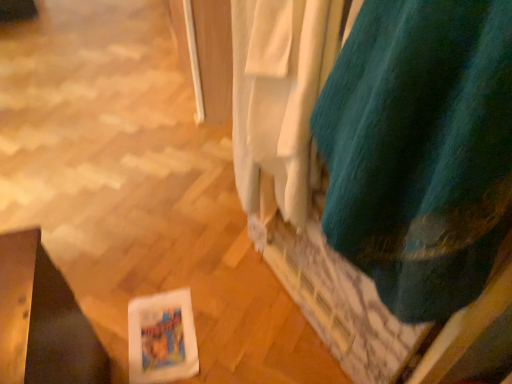
What do you see at coordinates (281, 94) in the screenshot?
I see `teal fabric curtain at upper right, which is the 2th curtain in right-to-left order` at bounding box center [281, 94].

This screenshot has height=384, width=512. In order to click on teal fabric curtain at upper right, which is the 2th curtain in right-to-left order in this screenshot , I will do click(x=281, y=94).

At what (x,y) coordinates should I click in order to perform the action: click on teal felt curtain at right, arranged as the first curtain when viewed from the right. Please return your answer as a coordinate pair (x, y). This screenshot has height=384, width=512. Looking at the image, I should click on (420, 149).

The height and width of the screenshot is (384, 512). What do you see at coordinates (420, 149) in the screenshot? I see `teal felt curtain at right, the second curtain positioned from the left` at bounding box center [420, 149].

Measure the distance between teal felt curtain at right, the second curtain positioned from the left, and camera.

teal felt curtain at right, the second curtain positioned from the left, and camera are 14.84 inches apart.

Where is `teal fabric curtain at upper right, which is the 2th curtain in right-to-left order`? Image resolution: width=512 pixels, height=384 pixels. teal fabric curtain at upper right, which is the 2th curtain in right-to-left order is located at coordinates (281, 94).

Between teal fabric curtain at upper right, which is the 1th curtain in left-to-right order, and teal felt curtain at right, arranged as the first curtain when viewed from the right, which one appears on the right side from the viewer's perspective?

Positioned to the right is teal felt curtain at right, arranged as the first curtain when viewed from the right.

Between teal fabric curtain at upper right, which is the 1th curtain in left-to-right order, and teal felt curtain at right, the second curtain positioned from the left, which one is positioned in front?

teal felt curtain at right, the second curtain positioned from the left, is in front.

Between point (284, 197) and point (390, 38), which one is positioned in front?

The point (390, 38) is closer to the camera.

From the image's perspective, which one is positioned higher, teal fabric curtain at upper right, which is the 2th curtain in right-to-left order, or teal felt curtain at right, the second curtain positioned from the left?

teal fabric curtain at upper right, which is the 2th curtain in right-to-left order, from the image's perspective.

From a real-world perspective, which object rests below the other?

From a 3D spatial view, teal fabric curtain at upper right, which is the 1th curtain in left-to-right order, is below.

Between teal fabric curtain at upper right, which is the 1th curtain in left-to-right order, and teal felt curtain at right, arranged as the first curtain when viewed from the right, which one has larger width?

Wider between the two is teal felt curtain at right, arranged as the first curtain when viewed from the right.

Does teal fabric curtain at upper right, which is the 2th curtain in right-to-left order, have a greater height compared to teal felt curtain at right, the second curtain positioned from the left?

Yes, teal fabric curtain at upper right, which is the 2th curtain in right-to-left order, is taller than teal felt curtain at right, the second curtain positioned from the left.

Who is bigger, teal fabric curtain at upper right, which is the 1th curtain in left-to-right order, or teal felt curtain at right, arranged as the first curtain when viewed from the right?

teal felt curtain at right, arranged as the first curtain when viewed from the right, is bigger.

Is teal fabric curtain at upper right, which is the 2th curtain in right-to-left order, outside of teal felt curtain at right, arranged as the first curtain when viewed from the right?

Yes, teal fabric curtain at upper right, which is the 2th curtain in right-to-left order, is outside of teal felt curtain at right, arranged as the first curtain when viewed from the right.

Is teal fabric curtain at upper right, which is the 1th curtain in left-to-right order, not close to teal felt curtain at right, the second curtain positioned from the left?

No, teal fabric curtain at upper right, which is the 1th curtain in left-to-right order, is not far from teal felt curtain at right, the second curtain positioned from the left.

Could you tell me if teal fabric curtain at upper right, which is the 2th curtain in right-to-left order, is facing teal felt curtain at right, arranged as the first curtain when viewed from the right?

No, teal fabric curtain at upper right, which is the 2th curtain in right-to-left order, is not facing towards teal felt curtain at right, arranged as the first curtain when viewed from the right.

The width and height of the screenshot is (512, 384). Identify the location of curtain below the teal fabric curtain at upper right, which is the 1th curtain in left-to-right order (from the image's perspective). (420, 149).

Is teal felt curtain at right, arranged as the first curtain when viewed from the right, to the left of teal fabric curtain at upper right, which is the 1th curtain in left-to-right order, from the viewer's perspective?

In fact, teal felt curtain at right, arranged as the first curtain when viewed from the right, is to the right of teal fabric curtain at upper right, which is the 1th curtain in left-to-right order.

Is teal felt curtain at right, the second curtain positioned from the left, closer to the viewer compared to teal fabric curtain at upper right, which is the 1th curtain in left-to-right order?

Yes, it is.

Is point (417, 110) behind point (294, 135)?

That is False.

From the image's perspective, which object appears higher, teal felt curtain at right, arranged as the first curtain when viewed from the right, or teal fabric curtain at upper right, which is the 1th curtain in left-to-right order?

teal fabric curtain at upper right, which is the 1th curtain in left-to-right order.

From a real-world perspective, which object stands above the other?

From a 3D spatial view, teal felt curtain at right, the second curtain positioned from the left, is above.

Between teal felt curtain at right, arranged as the first curtain when viewed from the right, and teal fabric curtain at upper right, which is the 2th curtain in right-to-left order, which one has larger width?

With larger width is teal felt curtain at right, arranged as the first curtain when viewed from the right.

Which of these two, teal felt curtain at right, arranged as the first curtain when viewed from the right, or teal fabric curtain at upper right, which is the 2th curtain in right-to-left order, stands shorter?

teal felt curtain at right, arranged as the first curtain when viewed from the right, is shorter.

Which of these two, teal felt curtain at right, the second curtain positioned from the left, or teal fabric curtain at upper right, which is the 2th curtain in right-to-left order, is bigger?

teal felt curtain at right, the second curtain positioned from the left.

Is teal fabric curtain at upper right, which is the 1th curtain in left-to-right order, a part of teal felt curtain at right, the second curtain positioned from the left?

No, teal fabric curtain at upper right, which is the 1th curtain in left-to-right order, is not a part of teal felt curtain at right, the second curtain positioned from the left.

Are teal felt curtain at right, arranged as the first curtain when viewed from the right, and teal fabric curtain at upper right, which is the 1th curtain in left-to-right order, making contact?

No, teal felt curtain at right, arranged as the first curtain when viewed from the right, is not making contact with teal fabric curtain at upper right, which is the 1th curtain in left-to-right order.

Is teal felt curtain at right, arranged as the first curtain when viewed from the right, oriented towards teal fabric curtain at upper right, which is the 1th curtain in left-to-right order?

No, teal felt curtain at right, arranged as the first curtain when viewed from the right, is not oriented towards teal fabric curtain at upper right, which is the 1th curtain in left-to-right order.

Based on the photo, could you measure the distance between teal felt curtain at right, the second curtain positioned from the left, and teal fabric curtain at upper right, which is the 1th curtain in left-to-right order?

teal felt curtain at right, the second curtain positioned from the left, is 7.87 inches away from teal fabric curtain at upper right, which is the 1th curtain in left-to-right order.

This screenshot has height=384, width=512. What are the coordinates of `curtain above the teal felt curtain at right, the second curtain positioned from the left (from the image's perspective)` in the screenshot? It's located at (281, 94).

The height and width of the screenshot is (384, 512). In the image, there is a teal felt curtain at right, the second curtain positioned from the left. What are the coordinates of `curtain above it (from the image's perspective)` in the screenshot? It's located at (281, 94).

Locate an element on the screen. curtain below the teal felt curtain at right, arranged as the first curtain when viewed from the right (from a real-world perspective) is located at coordinates (281, 94).